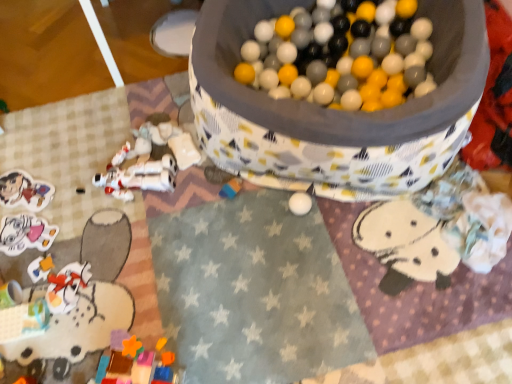
The width and height of the screenshot is (512, 384). Find the location of `vacant space to the left of multicolored plastic blocks at center, acting as the 5th toy starting from the left`. vacant space to the left of multicolored plastic blocks at center, acting as the 5th toy starting from the left is located at coordinates [x=186, y=203].